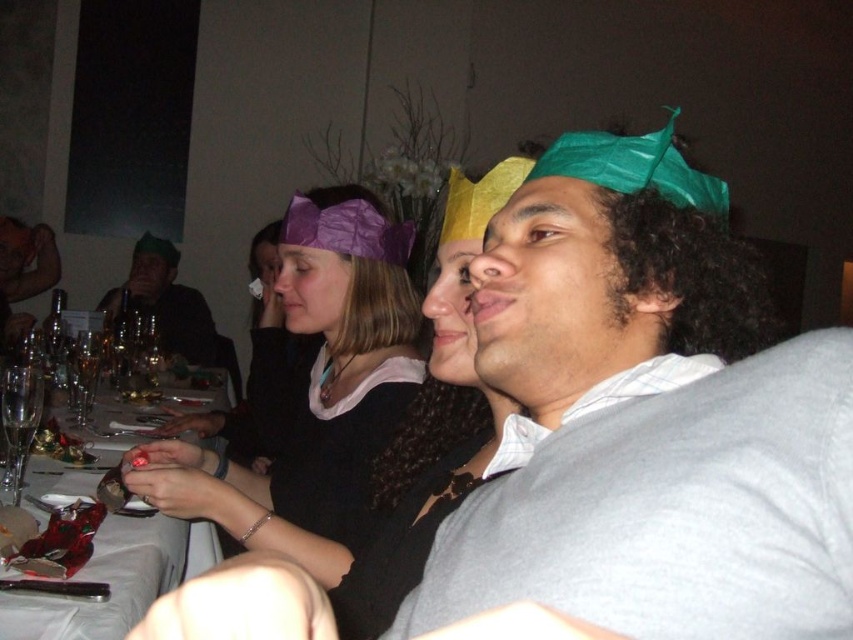
Can you confirm if green paper crown at center is bigger than purple paper crown at upper center?

No, green paper crown at center is not bigger than purple paper crown at upper center.

Between point (492, 348) and point (384, 516), which one is positioned in front?

Point (492, 348) is in front.

Image resolution: width=853 pixels, height=640 pixels. What do you see at coordinates (646, 419) in the screenshot?
I see `green paper crown at center` at bounding box center [646, 419].

This screenshot has width=853, height=640. I want to click on green paper crown at center, so click(x=646, y=419).

Who is more forward, (763, 339) or (109, 316)?

Point (763, 339) is in front.

The image size is (853, 640). Describe the element at coordinates (646, 419) in the screenshot. I see `green paper crown at center` at that location.

Which is in front, point (610, 216) or point (199, 364)?

Point (610, 216) is in front.

In order to click on green paper crown at center in this screenshot , I will do `click(646, 419)`.

In the scene shown: Between shiny silver spoon at left and clear glass wine glass at lower left, which one appears on the right side from the viewer's perspective?

shiny silver spoon at left is more to the right.

Does point (167, 522) come closer to viewer compared to point (33, 384)?

No, (167, 522) is behind (33, 384).

Locate an element on the screen. This screenshot has height=640, width=853. shiny silver spoon at left is located at coordinates (115, 579).